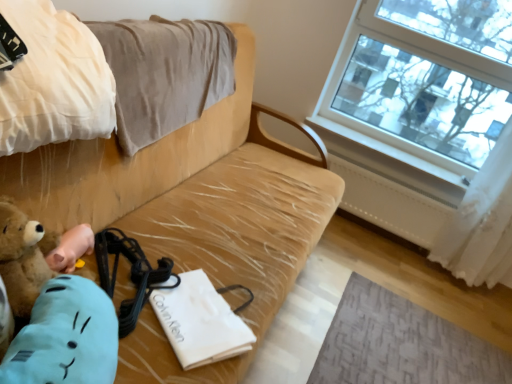
Find the location of a particular element. This screenshot has height=384, width=512. vacant space that is in between white sheer curtain at right and textured gray mat at lower right is located at coordinates (430, 289).